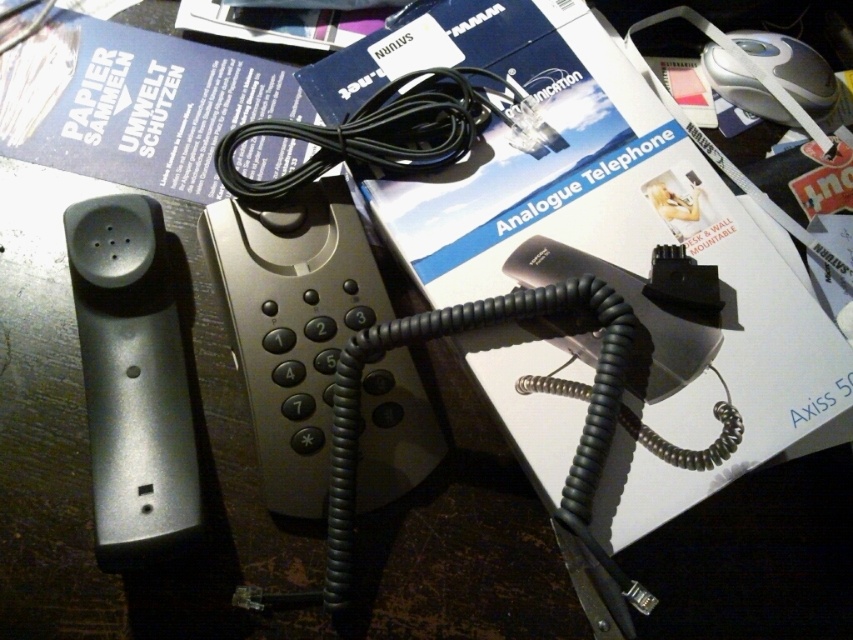
Between point (257, 161) and point (158, 486), which one is positioned in front?

Positioned in front is point (158, 486).

Who is shorter, blue paper at upper left or matte gray handset at left?

With less height is blue paper at upper left.

Which is behind, point (183, 115) or point (114, 273)?

Point (183, 115)

Locate an element on the screen. The image size is (853, 640). blue paper at upper left is located at coordinates (134, 104).

How far apart are matte gray handset at left and black cable at center?

matte gray handset at left and black cable at center are 8.17 inches apart.

Does matte gray handset at left have a greater height compared to black cable at center?

Yes, matte gray handset at left is taller than black cable at center.

Does point (149, 419) come closer to viewer compared to point (479, 104)?

That is True.

Locate an element on the screen. matte gray handset at left is located at coordinates (132, 380).

Measure the distance from blue paper at upper left to black cable at center.

blue paper at upper left and black cable at center are 6.34 inches apart.

Which is below, blue paper at upper left or black cable at center?

black cable at center is lower down.

Which is in front, point (32, 67) or point (422, 88)?

Point (422, 88)

Locate an element on the screen. blue paper at upper left is located at coordinates (134, 104).